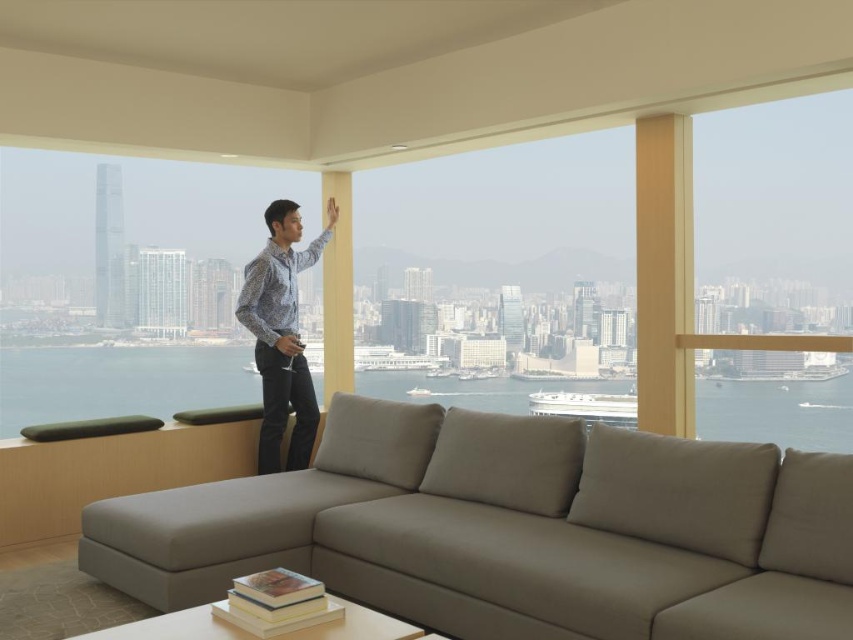
Does beige fabric couch at lower center have a larger size compared to patterned shirt at center?

Answer: Yes, beige fabric couch at lower center is bigger than patterned shirt at center.

Is beige fabric couch at lower center below patterned shirt at center?

Yes, beige fabric couch at lower center is below patterned shirt at center.

Between point (546, 445) and point (289, 243), which one is positioned in front?

Point (546, 445)

The height and width of the screenshot is (640, 853). I want to click on beige fabric couch at lower center, so click(x=511, y=529).

Is transparent glass window at center below clear glass window at upper right?

Yes.

Who is more forward, (519,172) or (727,204)?

Point (727,204) is in front.

Image resolution: width=853 pixels, height=640 pixels. I want to click on transparent glass window at center, so tap(509, 236).

Does transparent glass window at center appear on the right side of patterned shirt at center?

Indeed, transparent glass window at center is positioned on the right side of patterned shirt at center.

Which is behind, point (624, 234) or point (277, 211)?

Point (624, 234)

Is point (381, 218) more distant than point (287, 456)?

Yes, it is behind point (287, 456).

Image resolution: width=853 pixels, height=640 pixels. Find the location of `transparent glass window at center`. transparent glass window at center is located at coordinates (509, 236).